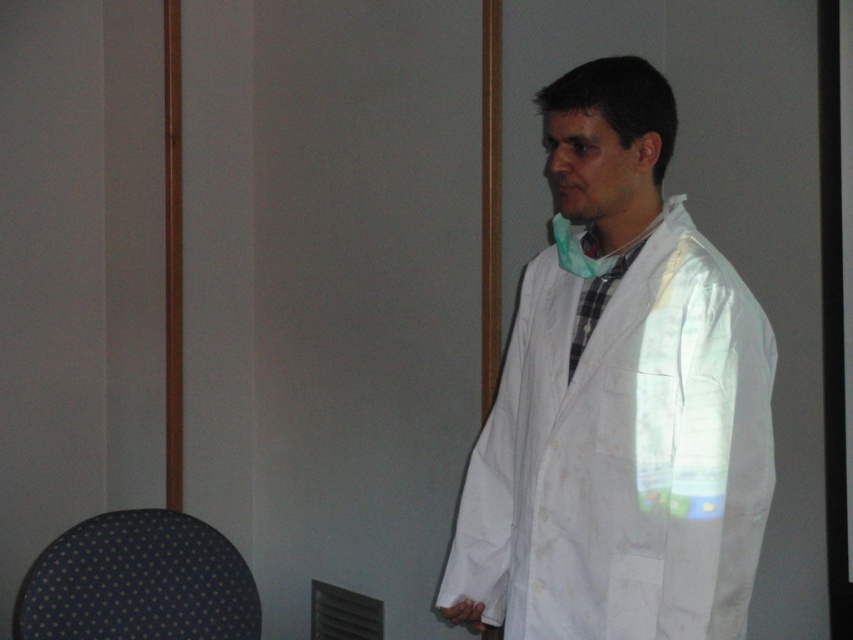
Who is positioned more to the left, white matte lab coat at center or dark blue fabric chair at lower left?

dark blue fabric chair at lower left

The width and height of the screenshot is (853, 640). Describe the element at coordinates (619, 403) in the screenshot. I see `white matte lab coat at center` at that location.

Image resolution: width=853 pixels, height=640 pixels. I want to click on white matte lab coat at center, so click(x=619, y=403).